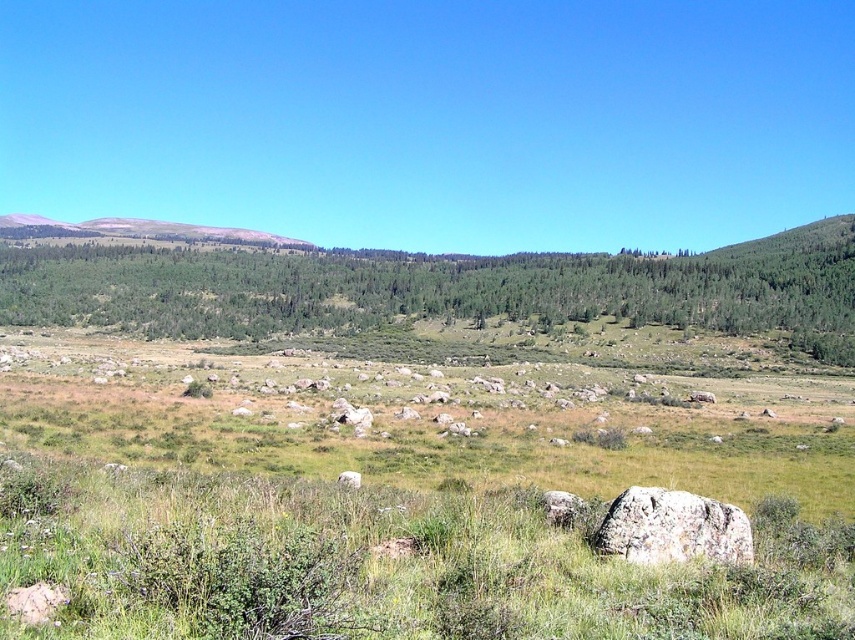
You are standing at the edge of the grassy field in the image. You see the gray rough boulder at lower right and the gray rough stone at center. Which object is closer to you?

The gray rough boulder at lower right is closer to you because it is positioned in front of the gray rough stone at center.

You are standing in the middle of the grassy field and see two points marked in the image. The first point is at coordinates point [732,544] and the second point is at point [345,481]. Which point is closer to you?

Point [732,544] is in front of point [345,481], so the first point is closer to you.

You are standing in the middle of the grassy field and want to reach the base of the smooth gray mountain at upper left. Which direction should you head towards to avoid the gray rough boulder at lower right?

To reach the base of the smooth gray mountain at upper left while avoiding the gray rough boulder at lower right, you should head towards the upper left direction since the gray rough boulder at lower right is located below the smooth gray mountain at upper left.